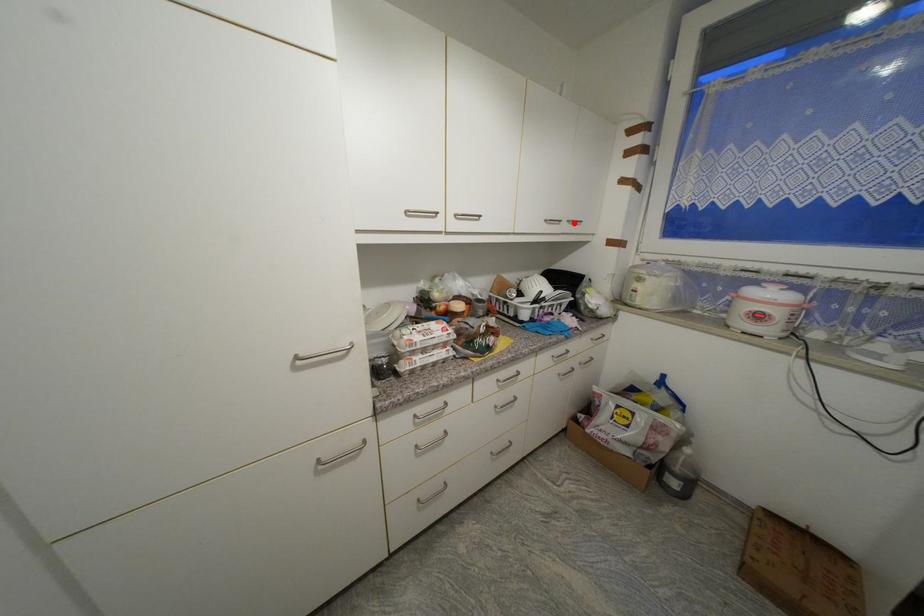
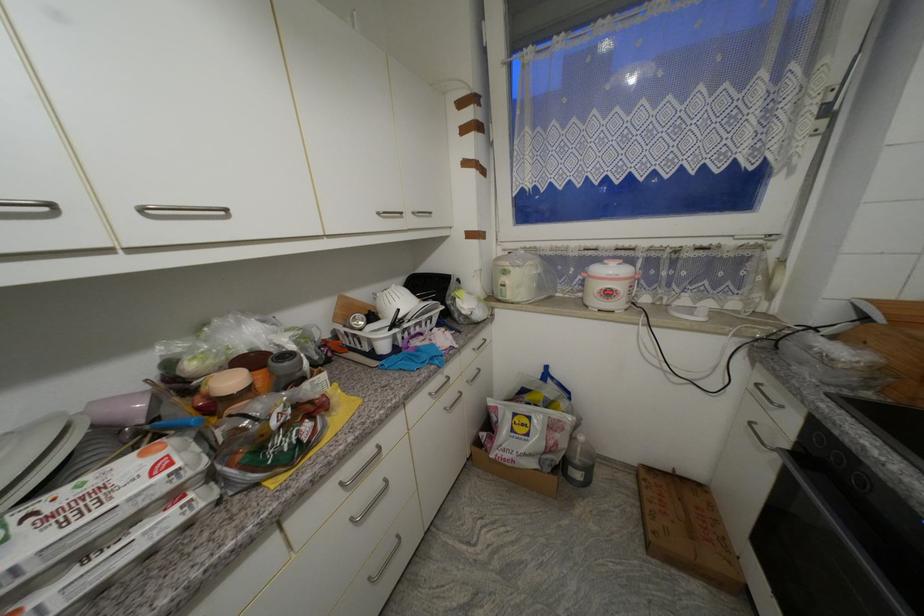
The point at the highlighted location is marked in the first image. Where is the corresponding point in the second image?

(419, 215)